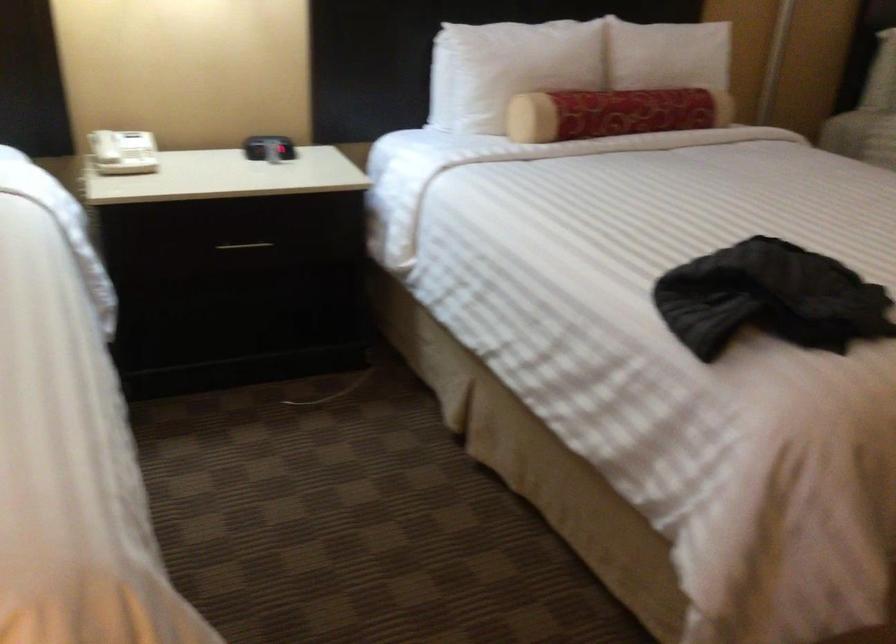
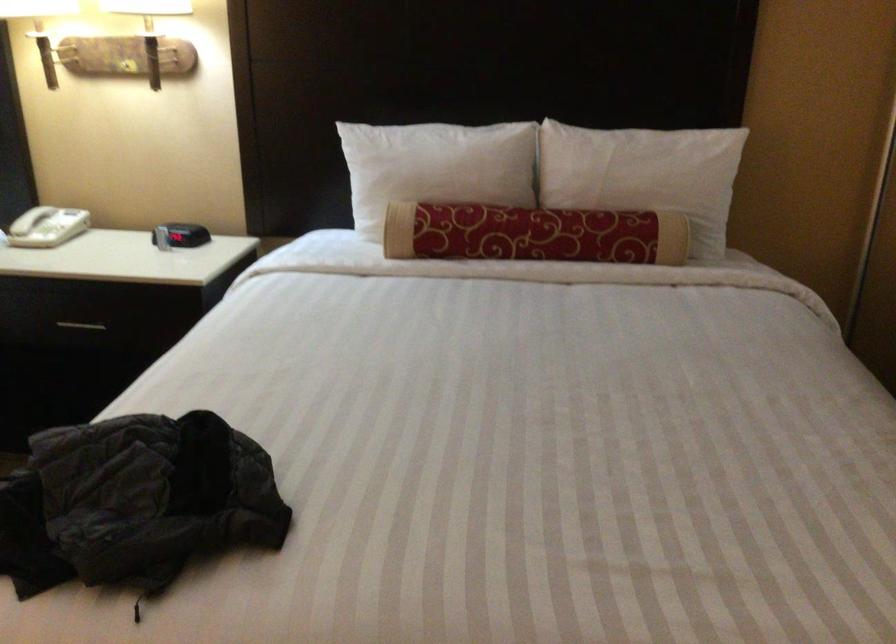
Locate, in the second image, the point that corresponds to point 122,151 in the first image.

(30, 220)